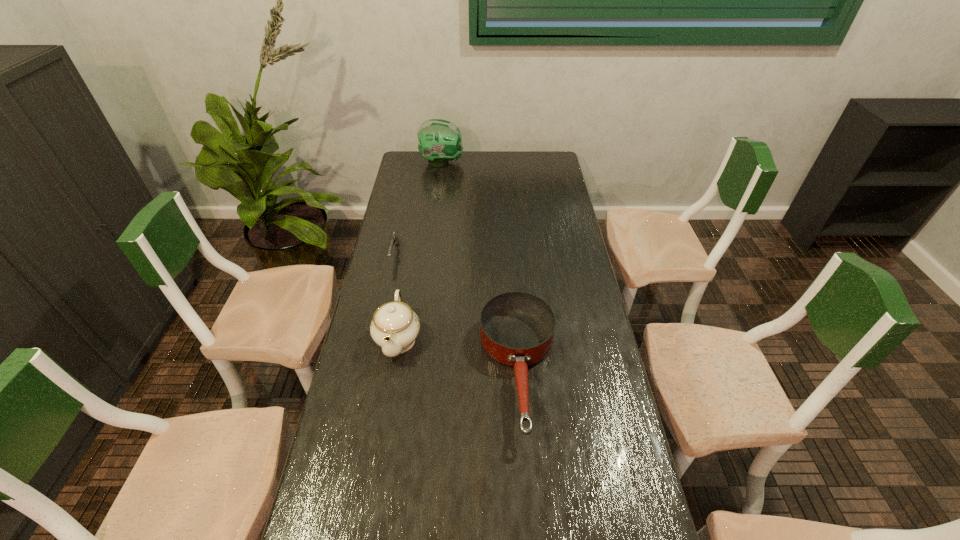
Find the location of a particular element. the tallest object is located at coordinates (440, 141).

Image resolution: width=960 pixels, height=540 pixels. I want to click on football helmet, so click(x=440, y=141).

Locate an element on the screen. The height and width of the screenshot is (540, 960). chinaware is located at coordinates (395, 326).

Where is `the third tallest object`? Image resolution: width=960 pixels, height=540 pixels. the third tallest object is located at coordinates (517, 329).

In order to click on pan in this screenshot , I will do `click(517, 329)`.

What are the coordinates of `the third nearest object` in the screenshot? It's located at (394, 239).

Locate an element on the screen. gun is located at coordinates (394, 239).

Locate an element on the screen. Image resolution: width=960 pixels, height=540 pixels. free space located 0.150m on the visor of the football helmet is located at coordinates (493, 162).

You are a GUI agent. You are given a task and a screenshot of the screen. Output one action in this format:
    pyautogui.click(x=<x>, y=<y>)
    Task: Click on the blank space located at the spout of the second tallest object
    The height and width of the screenshot is (540, 960).
    Given the screenshot: What is the action you would take?
    pyautogui.click(x=370, y=510)

At what (x,y) coordinates should I click in order to perform the action: click on vacant space situated on the handle side of the rightmost object. Please return your answer as a coordinate pair (x, y). The image size is (960, 540). Looking at the image, I should click on (531, 538).